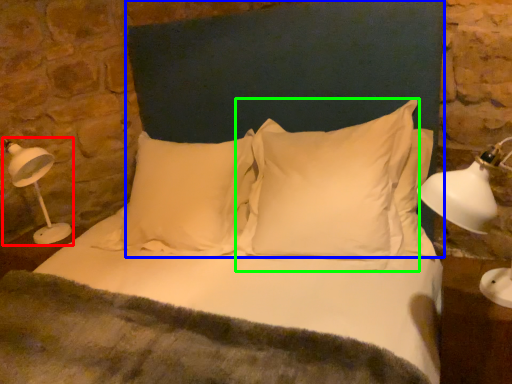
Question: Which is nearer to the table lamp (highlighted by a red box)? headboard (highlighted by a blue box) or pillow (highlighted by a green box).

Choices:
 (A) headboard
 (B) pillow

Answer: (A)